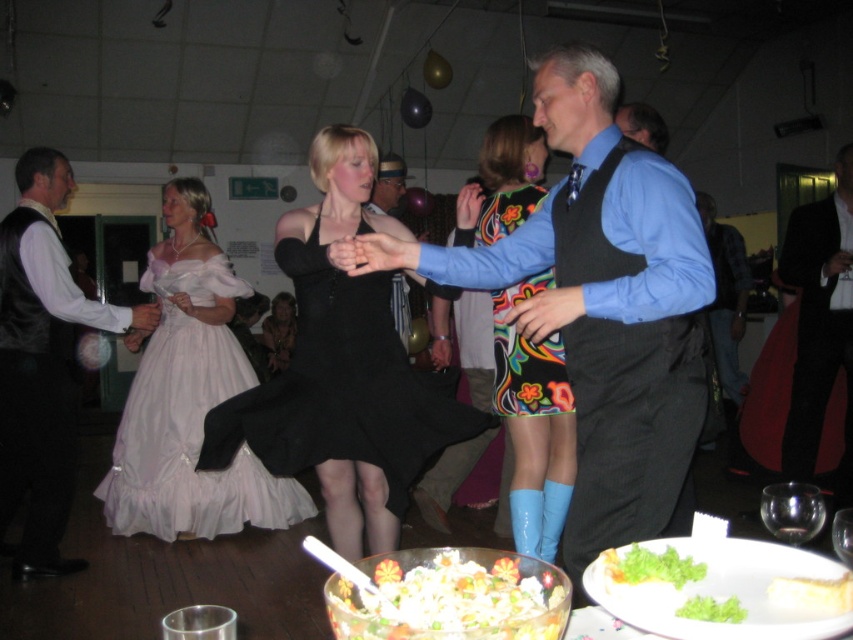
You are a photographer at the event and need to capture a photo that includes both the green leafy garnish at lower right and the velvet black dress at center. Considering their sizes, which object should you focus on first to ensure both fit in the frame?

The green leafy garnish at lower right has a lesser width compared to the velvet black dress at center, so you should focus on the larger velvet black dress at center first to ensure it fits, then adjust the frame to include the smaller green leafy garnish at lower right.

You are a photographer at the party and want to take a photo of the velvet black dress at center without the green leafy garnish at lower right blocking it. What should you do?

Move the camera to the side so that the velvet black dress at center is no longer behind the green leafy garnish at lower right, since the green leafy garnish at lower right is in front of it.